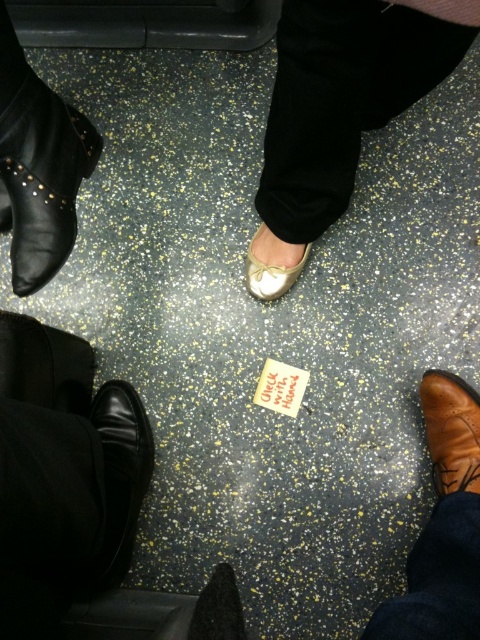
You are a janitor in the train station and you see the brown leather boot at lower right and the white leather shoe at center. Which one is taller?

The brown leather boot at lower right is taller than the white leather shoe at center.

You are a janitor in the train station and you see the brown leather boot at lower right and the small rectangular piece of paper lying on the floor. Which object is closer to you?

The brown leather boot at lower right is closer to you since it is 90.65 centimeters away from the small rectangular piece of paper lying on the floor.

You are a janitor cleaning the floor and notice the black leather boot at left and the shiny black shoe at center. Which object do you need to move first to avoid stepping on the small, rectangular piece of paper lying on the floor?

The black leather boot at left needs to be moved first because it is larger than the shiny black shoe at center and might cover the paper more completely.